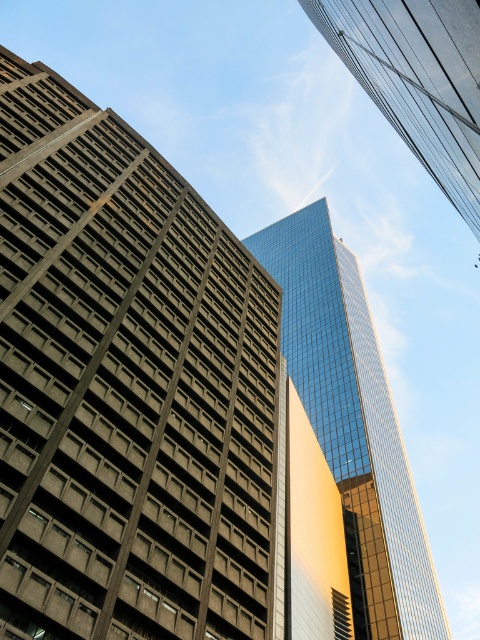
You are standing in the city square and want to take a photo of the glassy reflective skyscraper at center. If your camera has a maximum zoom range of 50 meters, will you be able to capture the entire skyscraper in one shot without moving closer?

The glassy reflective skyscraper at center is 55.93 meters away from the viewer. Since the camera can only zoom up to 50 meters, you won not be able to capture the entire skyscraper in one shot without moving closer.

You are a drone operator trying to navigate between two points in the city. You have a drone that can only fly up to 100 meters. The first point you need to reach is point [67,310] and the second is point [360,540]. Given the spatial relationship between these points, will your drone be able to reach both points without exceeding its maximum flight distance?

Point [67,310] is closer to the viewer than point [360,540]. The drone can reach both points as the distance between them depends on their positions, but since the maximum flight distance is 100 meters and the spatial relationship doesn not specify the exact distance, it is possible within the limit.